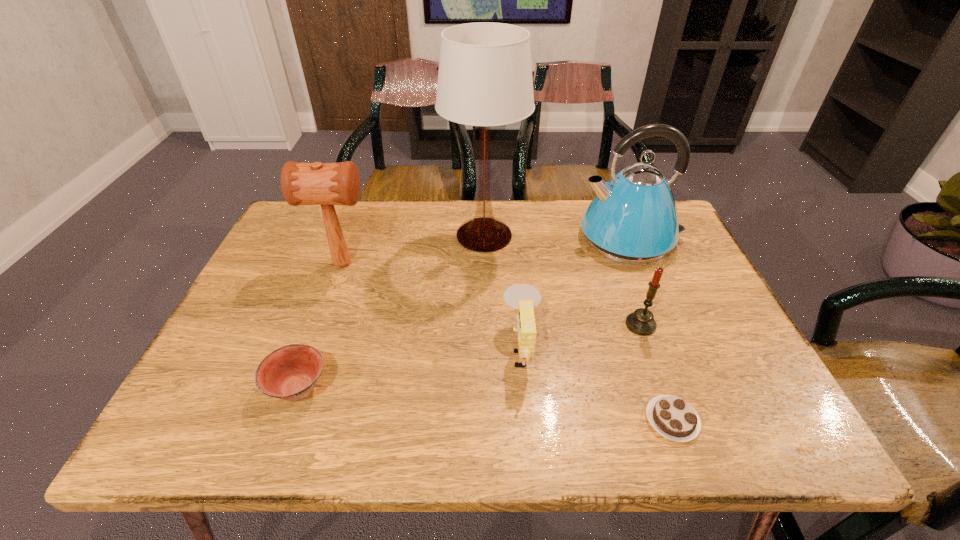
The image size is (960, 540). Identify the location of table lamp at the far edge. (485, 74).

The height and width of the screenshot is (540, 960). I want to click on kettle at the far edge, so click(633, 219).

This screenshot has height=540, width=960. In order to click on bowl present at the near edge in this screenshot , I will do `click(290, 373)`.

The height and width of the screenshot is (540, 960). Find the location of `chocolate cake that is at the near edge`. chocolate cake that is at the near edge is located at coordinates (672, 417).

You are a GUI agent. You are given a task and a screenshot of the screen. Output one action in this format:
    pyautogui.click(x=<x>, y=<y>)
    Task: Click on the mallet positioned at the left edge
    This screenshot has height=540, width=960.
    Given the screenshot: What is the action you would take?
    pyautogui.click(x=327, y=184)

Find the location of a particular element. bowl located at the left edge is located at coordinates (290, 373).

Find the location of a particular element. object at the right edge is located at coordinates (633, 219).

Locate an element on the screen. This screenshot has height=540, width=960. object located at the near left corner is located at coordinates (290, 373).

Locate an element on the screen. The height and width of the screenshot is (540, 960). object that is at the far right corner is located at coordinates (633, 219).

Find the location of a particular element. Image resolution: width=960 pixels, height=540 pixels. vacant space at the far edge of the desktop is located at coordinates (408, 243).